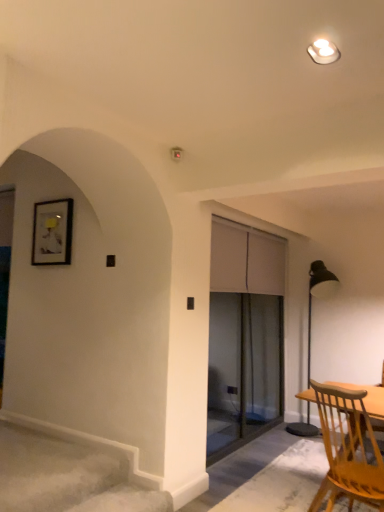
Question: Is point (289, 432) closer or farther from the camera than point (324, 58)?

Choices:
 (A) farther
 (B) closer

Answer: (A)

Question: Is metallic black floor lamp at right to the left or to the right of white glossy light fixture at upper center in the image?

Choices:
 (A) right
 (B) left

Answer: (A)

Question: Which of these objects is positioned farthest from the light brown wooden chair at lower right?

Choices:
 (A) metallic black floor lamp at right
 (B) transparent glass screen door at center
 (C) white glossy light fixture at upper center

Answer: (A)

Question: Which of these objects is positioned farthest from the transparent glass screen door at center?

Choices:
 (A) light brown wooden chair at lower right
 (B) metallic black floor lamp at right
 (C) white glossy light fixture at upper center

Answer: (C)